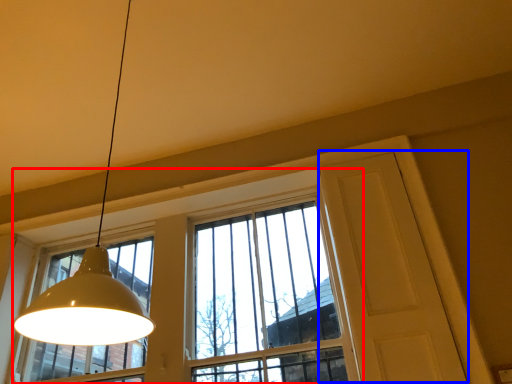
Question: Which object appears closest to the camera in this image, window (highlighted by a red box) or screen door (highlighted by a blue box)?

Choices:
 (A) window
 (B) screen door

Answer: (B)